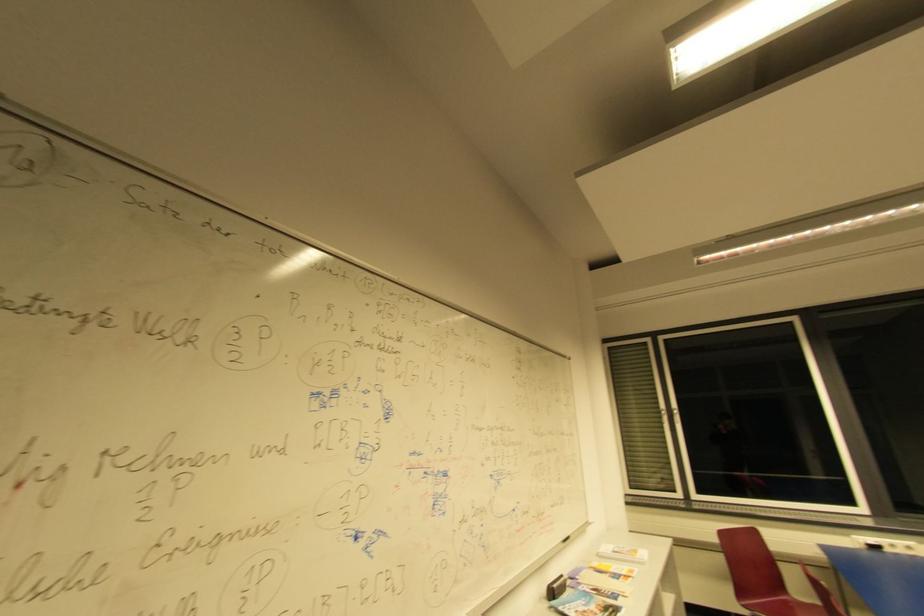
Find where to sit the red chair sitting surface. Please return your answer as a coordinate pair (x, y).

(788, 604)